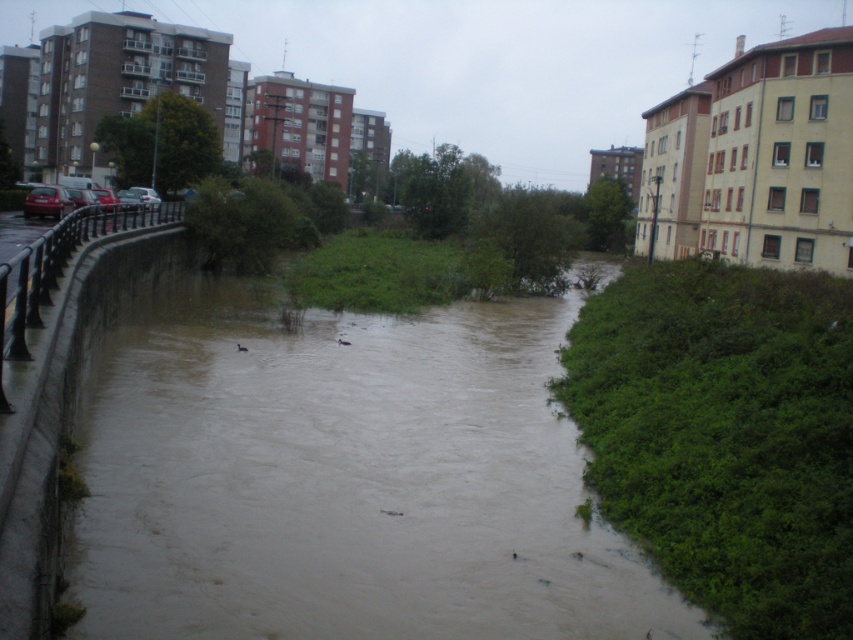
Who is lower down, brown muddy water at center or shiny red car at left?

brown muddy water at center is lower down.

Is brown muddy water at center positioned before shiny red car at left?

Yes, brown muddy water at center is closer to the viewer.

Is point (479, 625) positioned in front of point (39, 205)?

That is True.

Image resolution: width=853 pixels, height=640 pixels. I want to click on brown muddy water at center, so click(x=344, y=477).